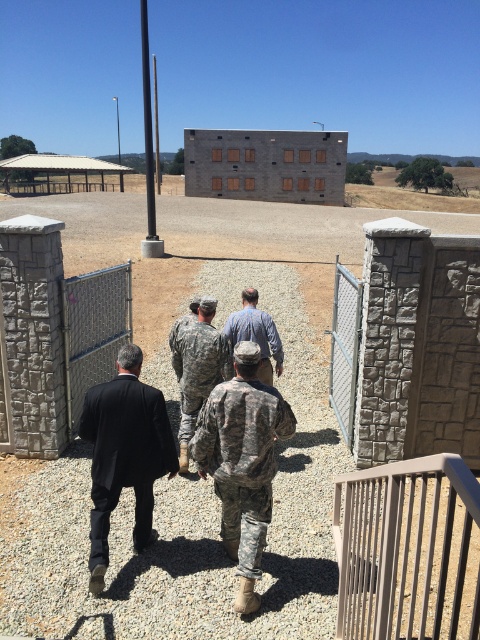
Question: Is camouflage fabric uniform at center positioned in front of wire mesh fence at center?

Choices:
 (A) yes
 (B) no

Answer: (A)

Question: Which point appears closest to the camera in this image?

Choices:
 (A) (463, 552)
 (B) (212, 474)
 (C) (183, 332)

Answer: (A)

Question: Does gray stone building at center appear on the left side of metallic silver gate at center-right?

Choices:
 (A) yes
 (B) no

Answer: (B)

Question: Which point is closer to the camera?

Choices:
 (A) metallic silver gate at center-right
 (B) brown metal fence at lower right

Answer: (B)

Question: Which object is farther from the camera taking this photo?

Choices:
 (A) gray stone building at center
 (B) camouflage fabric uniform at center

Answer: (A)

Question: Can you confirm if wire mesh fence at center is thinner than camouflage uniform at center?

Choices:
 (A) yes
 (B) no

Answer: (A)